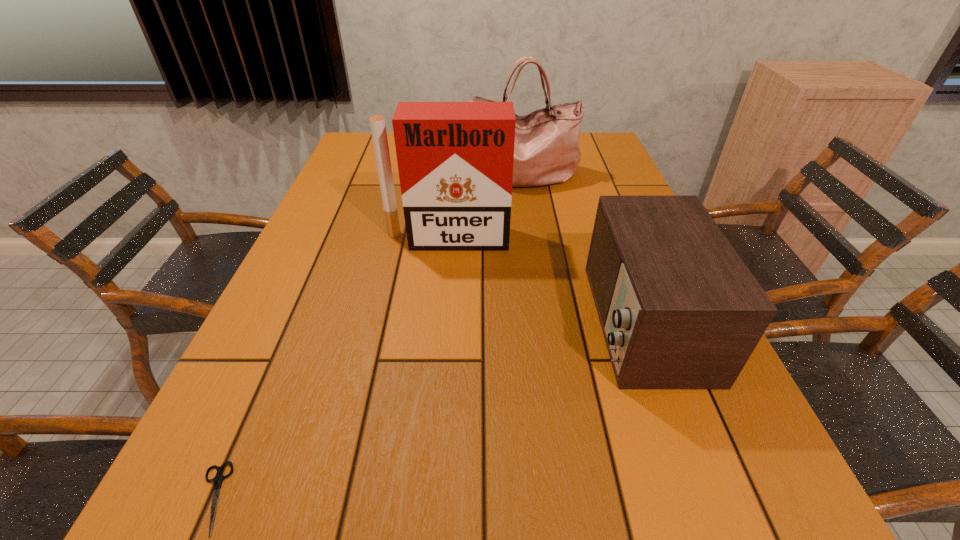
Select which object is the third closest to the farthest object. Please provide its 2D coordinates. Your answer should be formatted as a tuple, i.e. [(x, y)], where the tuple contains the x and y coordinates of a point satisfying the conditions above.

[(217, 481)]

Where is `object that is the third closest one to the shortest object`? object that is the third closest one to the shortest object is located at coordinates (546, 151).

In order to click on free location that satisfies the following two spatial constraints: 1. on the front-facing side of the second nearest object; 2. on the front side of the leftmost object in this screenshot , I will do `click(709, 498)`.